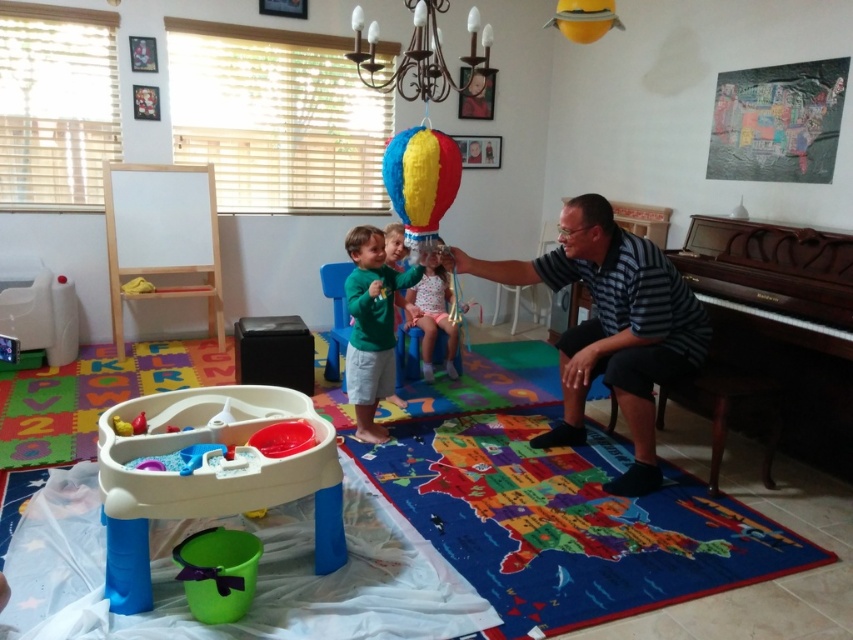
From the picture: You are a parent trying to place a new rectangular toy box that is 1.2 meters wide in the playroom. The brown polished wood piano at right and the blue plastic chair at center are already in the room. Which object should you consider when determining space availability for the toy box?

The brown polished wood piano at right has a larger width than the blue plastic chair at center. Since the toy box is 1.2 meters wide, you should check the space next to the brown polished wood piano at right first to ensure there is enough room, as it occupies more width compared to the blue plastic chair at center.

From the picture: You are a photographer setting up a shoot in this room. You need to position a light stand so that it doesn not block the view of the green matte shirt at center. Where should you place the light stand relative to the metallic chandelier at upper center?

The green matte shirt at center is below the metallic chandelier at upper center. To avoid blocking the view of the green matte shirt at center, the light stand should be placed above the metallic chandelier at upper center so it doesn not interfere with the line of sight.